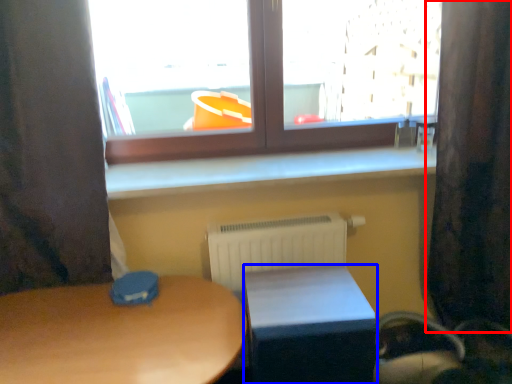
Question: Which of the following is the closest to the observer, curtain (highlighted by a red box) or table (highlighted by a blue box)?

Choices:
 (A) curtain
 (B) table

Answer: (B)